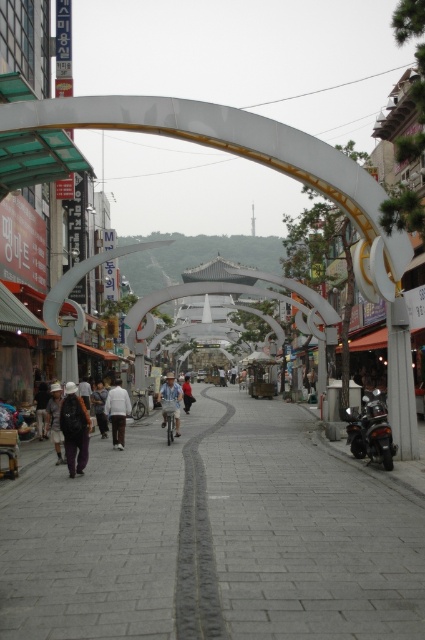
Question: Which object appears closest to the camera in this image?

Choices:
 (A) dark gray backpack at center
 (B) shiny black motorcycle at lower right

Answer: (A)

Question: Is dark gray backpack at center positioned at the back of light brown leather jacket at lower left?

Choices:
 (A) yes
 (B) no

Answer: (B)

Question: Is white matte shirt at center wider than dark gray backpack at lower left?

Choices:
 (A) yes
 (B) no

Answer: (A)

Question: Which of the following is the closest to the observer?

Choices:
 (A) (x=45, y=577)
 (B) (x=42, y=436)

Answer: (A)

Question: Does dark gray backpack at center have a smaller size compared to dark gray backpack at lower left?

Choices:
 (A) no
 (B) yes

Answer: (A)

Question: Which point is closer to the camera taking this photo?

Choices:
 (A) (36, 396)
 (B) (396, 520)
 (C) (102, 428)

Answer: (B)